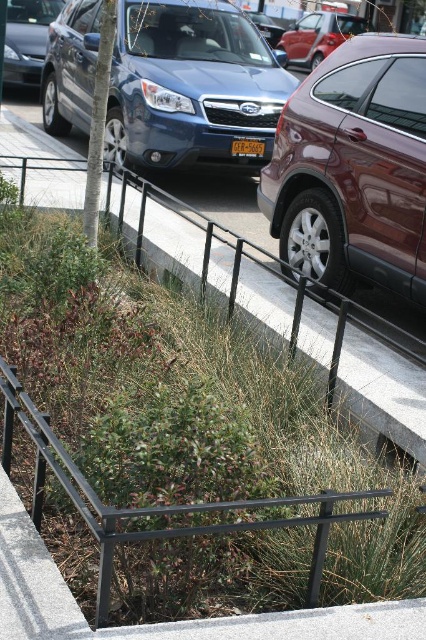
You are a delivery person trying to park your 6.5 feet tall delivery van. You see the shiny maroon suv at center and the shiny metallic sedan at upper left in the parking lot. Which vehicle can your van fit next to without hitting the roof?

The shiny metallic sedan at upper left is taller than the shiny maroon suv at center, so the delivery van should park next to the shiny maroon suv at center since it is shorter and allows enough clearance.

You are standing at the point with coordinates point (x=345, y=106) and want to walk towards the point with coordinates point (x=241, y=141). Which direction should you face to walk directly towards your destination?

You should face towards the direction of point (x=241, y=141) since it is behind point (x=345, y=106).

You are a delivery person who needs to load a tall package into your truck. The package is 1.8 meters in height. You have two options for parking spots next to the matte blue car at center and the metallic red car at center. Which parking spot would allow your truck to fit without hitting the package on the car?

The matte blue car at center is taller than the metallic red car at center. Since the package is 1.8 meters tall, you should choose the parking spot next to the metallic red car at center because it is shorter and less likely to hit the package.